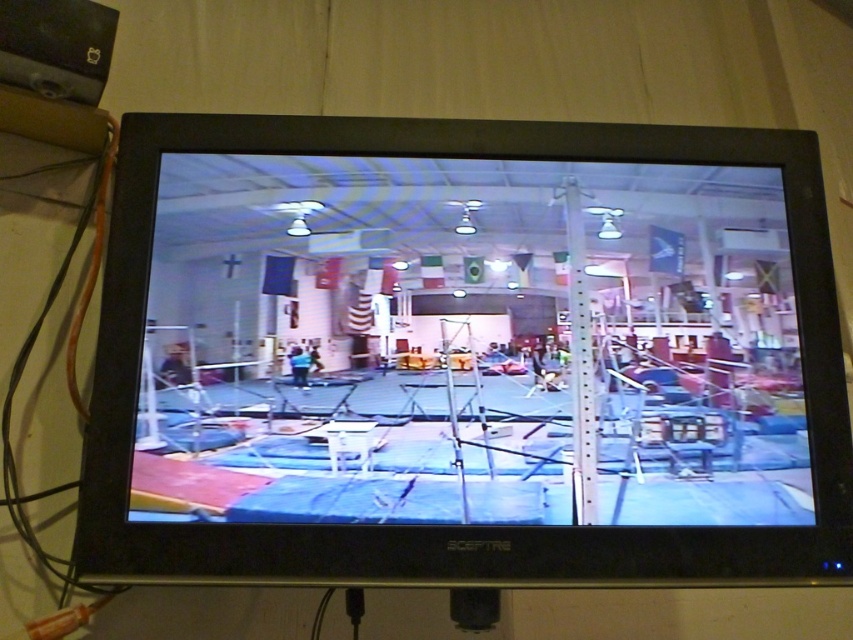
Does blue mat at center appear on the right side of orange cable at left?

Correct, you'll find blue mat at center to the right of orange cable at left.

Can you confirm if blue mat at center is bigger than orange cable at left?

Yes.

Which is behind, point (786, 250) or point (9, 484)?

The point (9, 484) is more distant.

At what (x,y) coordinates should I click in order to perform the action: click on blue mat at center. Please return your answer as a coordinate pair (x, y). Looking at the image, I should click on (469, 342).